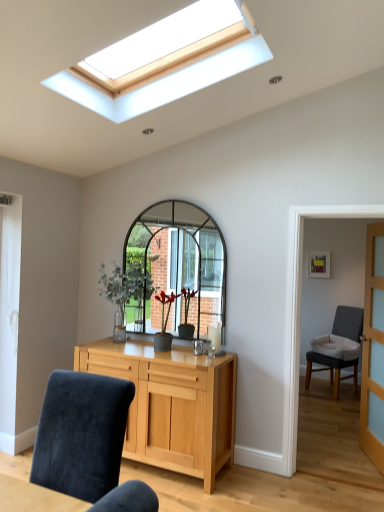
Locate an element on the screen. empty space that is ontop of light wood cabinet at center (from a real-world perspective) is located at coordinates (149, 349).